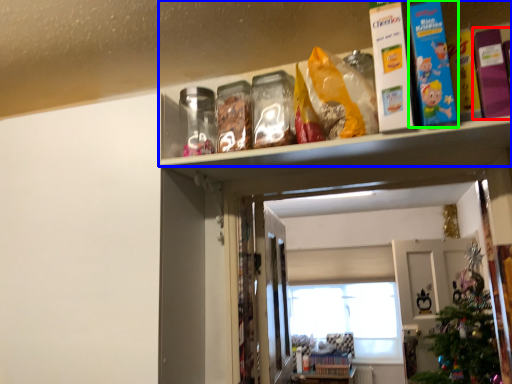
Question: Considering the real-world distances, which object is farthest from book (highlighted by a red box)? shelf (highlighted by a blue box) or book (highlighted by a green box)?

Choices:
 (A) shelf
 (B) book

Answer: (A)